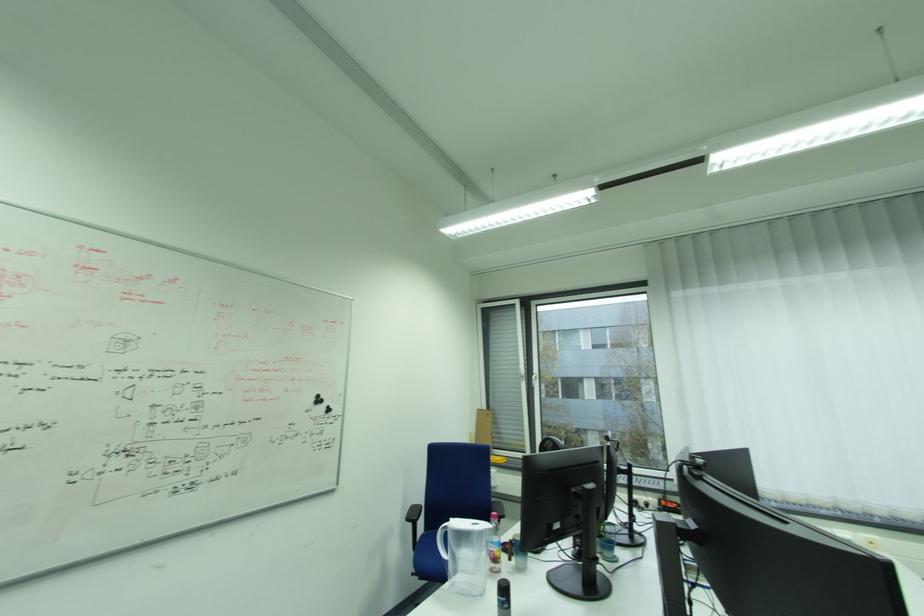
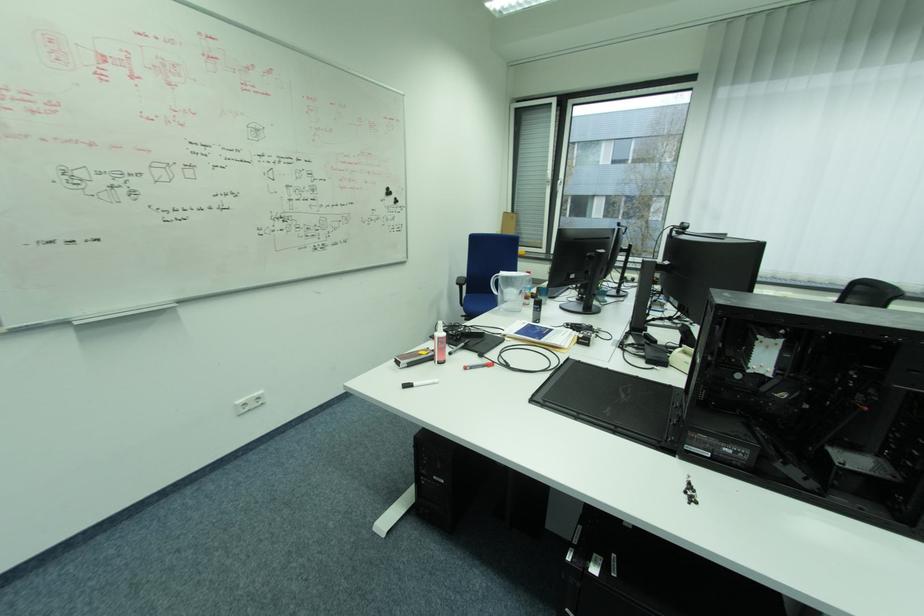
Question: How did the camera likely rotate?

Choices:
 (A) Left
 (B) Right
 (C) Up
 (D) Down

Answer: (D)